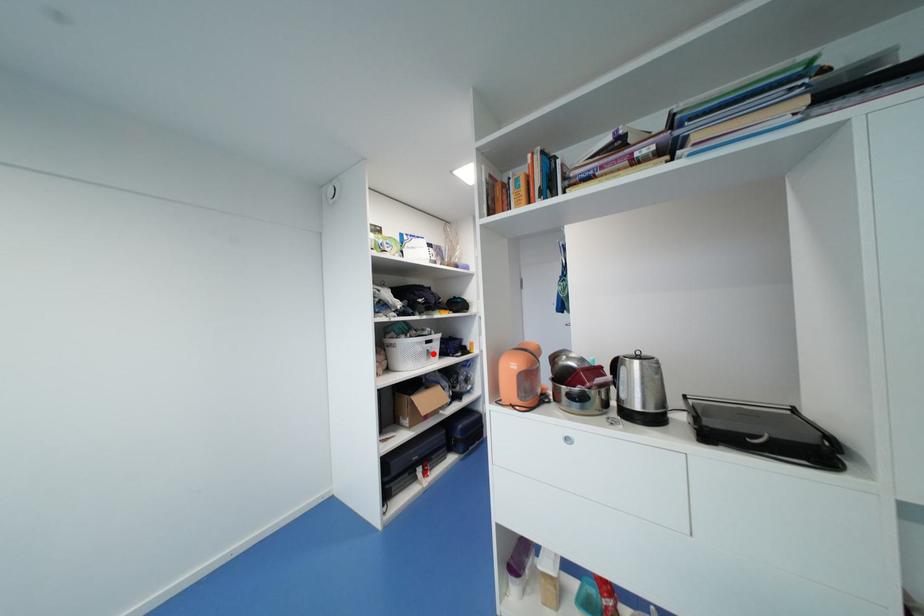
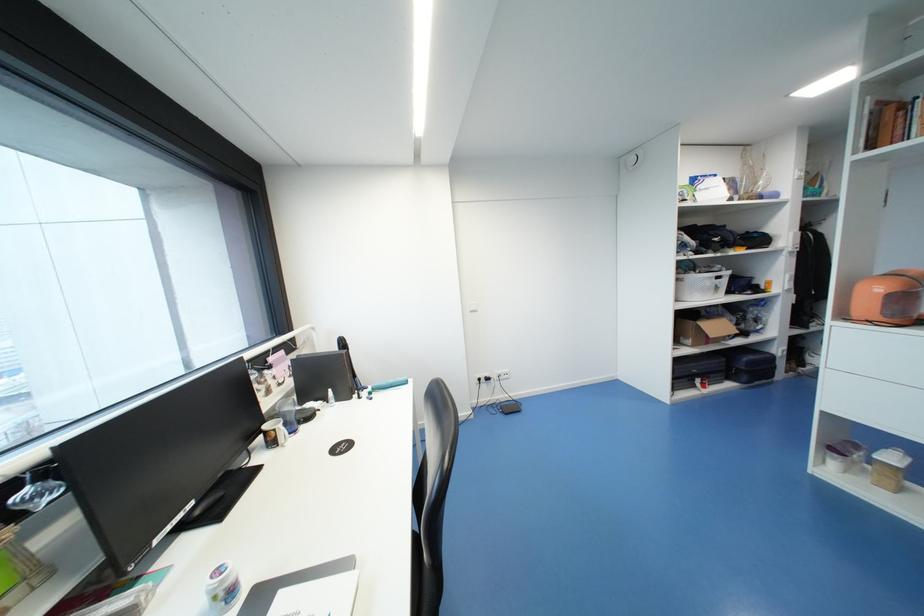
Question: I am providing you with two images of the same scene from different viewpoints. A red point is marked on the first image. At the location where the point appears in image 1, is it still visible in image 2?

Choices:
 (A) Yes
 (B) No

Answer: (A)